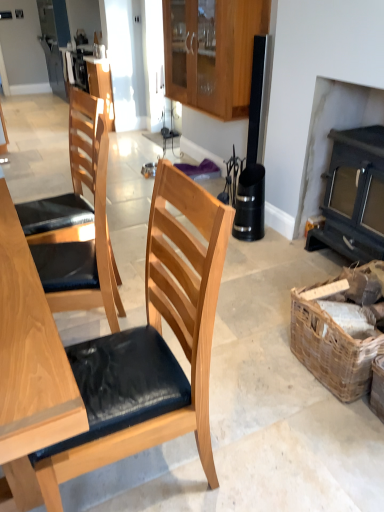
Question: Is dark gray wood fireplace at right taller than light brown wood chair at left, marked as the 1th chair in a top-to-bottom arrangement?

Choices:
 (A) no
 (B) yes

Answer: (B)

Question: Are dark gray wood fireplace at right and light brown wood chair at left, which appears as the 2th chair when ordered from the bottom, located far from each other?

Choices:
 (A) yes
 (B) no

Answer: (A)

Question: From a real-world perspective, is dark gray wood fireplace at right located higher than light brown wood chair at left, marked as the 1th chair in a top-to-bottom arrangement?

Choices:
 (A) no
 (B) yes

Answer: (A)

Question: From the image's perspective, would you say dark gray wood fireplace at right is positioned over light brown wood chair at left, which appears as the 2th chair when ordered from the bottom?

Choices:
 (A) no
 (B) yes

Answer: (B)

Question: Does dark gray wood fireplace at right touch light brown wood chair at left, marked as the 1th chair in a top-to-bottom arrangement?

Choices:
 (A) no
 (B) yes

Answer: (A)

Question: Is dark gray wood fireplace at right spatially inside light brown wood chair at left, which appears as the 2th chair when ordered from the bottom, or outside of it?

Choices:
 (A) inside
 (B) outside

Answer: (B)

Question: Is dark gray wood fireplace at right wider or thinner than light brown wood chair at left, which appears as the 2th chair when ordered from the bottom?

Choices:
 (A) wide
 (B) thin

Answer: (B)

Question: Is dark gray wood fireplace at right bigger or smaller than light brown wood chair at left, which appears as the 2th chair when ordered from the bottom?

Choices:
 (A) small
 (B) big

Answer: (B)

Question: From a real-world perspective, relative to light brown wood chair at left, which appears as the 2th chair when ordered from the bottom, is dark gray wood fireplace at right vertically above or below?

Choices:
 (A) above
 (B) below

Answer: (B)

Question: Visually, is woven brown picnic basket at lower right positioned to the left or to the right of wooden chair with cushion at center, which is the 1th chair from bottom to top?

Choices:
 (A) right
 (B) left

Answer: (A)

Question: Is woven brown picnic basket at lower right situated inside wooden chair with cushion at center, which is the 1th chair from bottom to top, or outside?

Choices:
 (A) inside
 (B) outside

Answer: (B)

Question: From a real-world perspective, is woven brown picnic basket at lower right positioned above or below wooden chair with cushion at center, the 2th chair viewed from the top?

Choices:
 (A) above
 (B) below

Answer: (B)

Question: In terms of size, does woven brown picnic basket at lower right appear bigger or smaller than wooden chair with cushion at center, which is the 1th chair from bottom to top?

Choices:
 (A) big
 (B) small

Answer: (B)

Question: Choose the correct answer: Is matte wood cabinet at upper center, the first cabinetry in the back-to-front sequence, inside light brown wood chair at left, which appears as the 2th chair when ordered from the bottom, or outside it?

Choices:
 (A) outside
 (B) inside

Answer: (A)

Question: From a real-world perspective, is matte wood cabinet at upper center, which is the second cabinetry in right-to-left order, physically located above or below light brown wood chair at left, marked as the 1th chair in a top-to-bottom arrangement?

Choices:
 (A) above
 (B) below

Answer: (B)